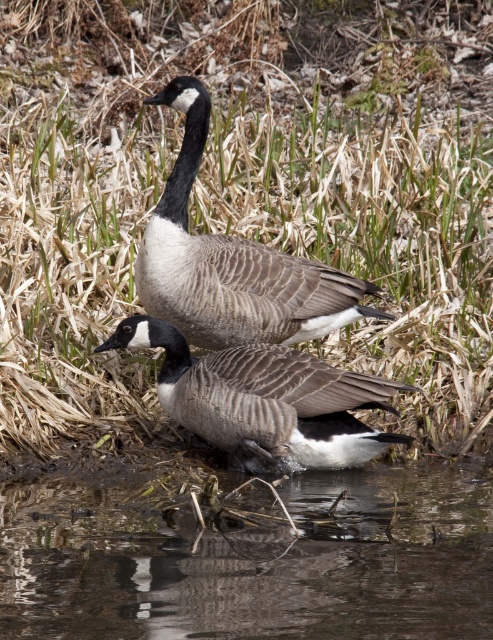
You are a birdwatcher observing the scene. You notice the brown textured duck at center and the brown murky water at lower center. Which object is taller in the image?

The brown textured duck at center is taller than the brown murky water at lower center.

You are a photographer aiming to capture a clear shot of the gray matte goose at center without the brown murky water at lower center obstructing the view. Based on their positions, can you adjust your angle to focus solely on the goose?

The brown murky water at lower center is closer to the viewer than the gray matte goose at center, so adjusting your angle to look past the water might still allow you to focus on the goose by framing it above or behind the water.

Looking at this image, you are a birdwatcher observing the scene. You notice the brown textured duck at center and the brown murky water at lower center. Which object is closer to you, the observer?

The brown murky water at lower center is closer to you because it is positioned in front of the brown textured duck at center.